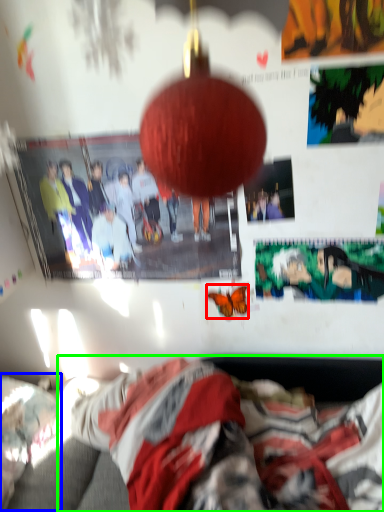
Question: Considering the real-world distances, which object is farthest from butterfly (highlighted by a red box)? bed (highlighted by a blue box) or person (highlighted by a green box)?

Choices:
 (A) bed
 (B) person

Answer: (A)